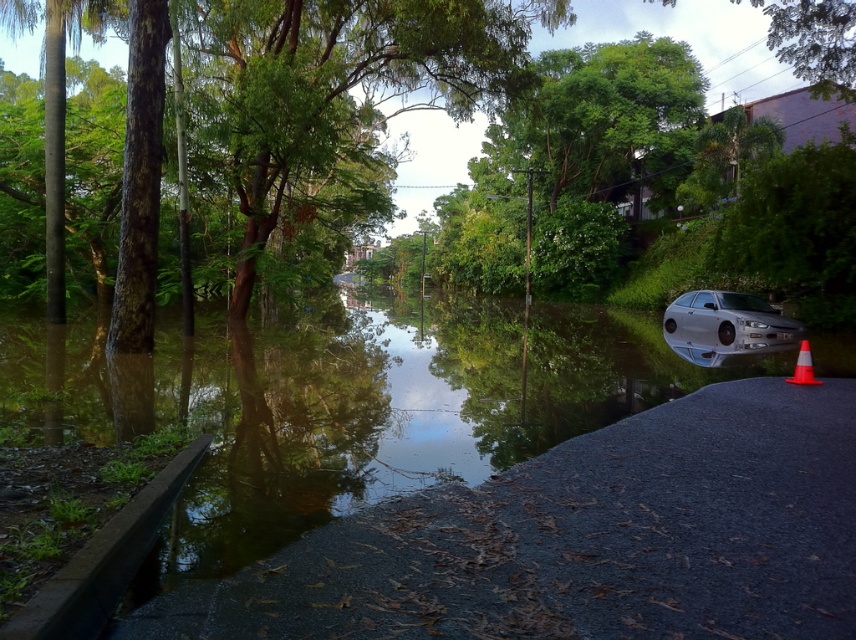
Who is higher up, clear water at road right or orange reflective cone at lower right?

clear water at road right

Between point (438, 333) and point (797, 372), which one is positioned behind?

The point (438, 333) is more distant.

Find the location of a particular element. This screenshot has width=856, height=640. clear water at road right is located at coordinates (345, 404).

Looking at this image, who is shorter, clear water at road right or silver metallic car at lower right?

Standing shorter between the two is silver metallic car at lower right.

Is clear water at road right to the right of silver metallic car at lower right from the viewer's perspective?

Incorrect, clear water at road right is not on the right side of silver metallic car at lower right.

Does point (110, 440) come behind point (667, 312)?

That is False.

Find the location of `clear water at road right`. clear water at road right is located at coordinates (345, 404).

In the scene shown: Is silver metallic car at lower right thinner than orange reflective cone at lower right?

No.

In the scene shown: Can you confirm if silver metallic car at lower right is bigger than orange reflective cone at lower right?

Yes.

Is point (744, 352) positioned before point (801, 371)?

No.

The width and height of the screenshot is (856, 640). I want to click on silver metallic car at lower right, so click(724, 324).